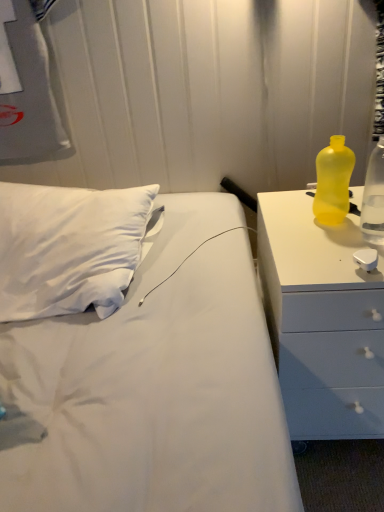
Question: Visually, is yellow translucent bottle at right, the first bottle positioned from the right, positioned to the left or to the right of yellow plastic bottle at right?

Choices:
 (A) right
 (B) left

Answer: (A)

Question: In the image, is yellow translucent bottle at right, the 2th bottle viewed from the left, positioned in front of or behind yellow plastic bottle at right?

Choices:
 (A) behind
 (B) front

Answer: (A)

Question: Which object is the farthest from the yellow plastic bottle at right?

Choices:
 (A) yellow translucent bottle at right, the first bottle positioned from the right
 (B) yellow translucent bottle at right, positioned as the 2th bottle in right-to-left order

Answer: (A)

Question: Which object is the closest to the yellow plastic bottle at right?

Choices:
 (A) yellow translucent bottle at right, the 2th bottle viewed from the left
 (B) yellow translucent bottle at right, positioned as the 2th bottle in right-to-left order

Answer: (B)